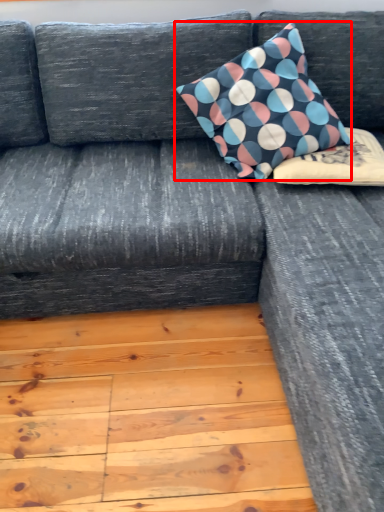
Question: Where is pillow (annotated by the red box) located in relation to pillow in the image?

Choices:
 (A) left
 (B) right

Answer: (A)